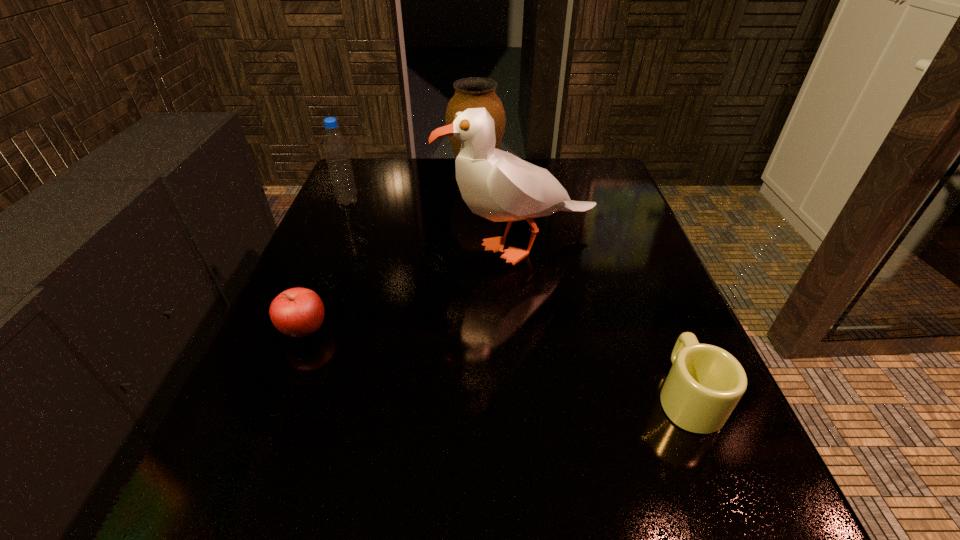
At what (x,y) coordinates should I click in order to perform the action: click on free space that satisfies the following two spatial constraints: 1. with the handle on the side of the rightmost object; 2. at the beak of the tallest object. Please return your answer as a coordinate pair (x, y). The width and height of the screenshot is (960, 540). Looking at the image, I should click on (626, 247).

The width and height of the screenshot is (960, 540). In order to click on free space that satisfies the following two spatial constraints: 1. at the beak of the gull; 2. with the handle on the side of the rightmost object in this screenshot , I will do `click(538, 396)`.

Identify the location of free space that satisfies the following two spatial constraints: 1. at the beak of the tallest object; 2. with the handle on the side of the nearest object. (538, 396).